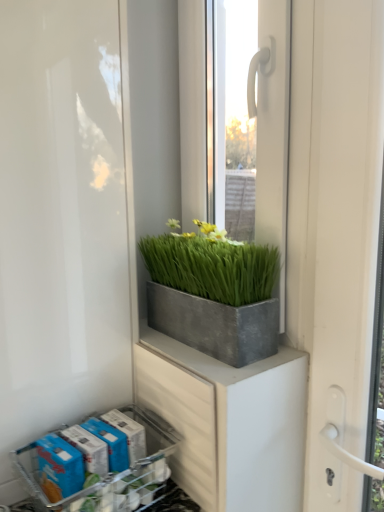
Question: Is metallic gray flower box at lower left positioned before clear glass window at center?

Choices:
 (A) yes
 (B) no

Answer: (A)

Question: Can you confirm if metallic gray flower box at lower left is wider than clear glass window at center?

Choices:
 (A) yes
 (B) no

Answer: (A)

Question: Considering the relative sizes of metallic gray flower box at lower left and clear glass window at center in the image provided, is metallic gray flower box at lower left smaller than clear glass window at center?

Choices:
 (A) no
 (B) yes

Answer: (B)

Question: Considering the relative sizes of metallic gray flower box at lower left and clear glass window at center in the image provided, is metallic gray flower box at lower left shorter than clear glass window at center?

Choices:
 (A) no
 (B) yes

Answer: (B)

Question: Can clear glass window at center be found inside metallic gray flower box at lower left?

Choices:
 (A) no
 (B) yes

Answer: (A)

Question: Is metallic gray flower box at lower left spatially inside white matte screen door at left, or outside of it?

Choices:
 (A) inside
 (B) outside

Answer: (B)

Question: Considering their positions, is metallic gray flower box at lower left located in front of or behind white matte screen door at left?

Choices:
 (A) behind
 (B) front

Answer: (A)

Question: From the image's perspective, is metallic gray flower box at lower left above or below white matte screen door at left?

Choices:
 (A) above
 (B) below

Answer: (B)

Question: From a real-world perspective, relative to white matte screen door at left, is metallic gray flower box at lower left vertically above or below?

Choices:
 (A) above
 (B) below

Answer: (B)

Question: In the image, is clear glass window at center positioned in front of or behind white matte screen door at left?

Choices:
 (A) behind
 (B) front

Answer: (A)

Question: Considering the positions of clear glass window at center and white matte screen door at left in the image, is clear glass window at center wider or thinner than white matte screen door at left?

Choices:
 (A) wide
 (B) thin

Answer: (B)

Question: From the image's perspective, is clear glass window at center above or below white matte screen door at left?

Choices:
 (A) above
 (B) below

Answer: (A)

Question: Does point (279, 225) appear closer or farther from the camera than point (18, 369)?

Choices:
 (A) farther
 (B) closer

Answer: (A)

Question: Considering the positions of white matte screen door at left and metallic gray flower box at lower left in the image, is white matte screen door at left wider or thinner than metallic gray flower box at lower left?

Choices:
 (A) wide
 (B) thin

Answer: (A)

Question: Is white matte screen door at left taller or shorter than metallic gray flower box at lower left?

Choices:
 (A) tall
 (B) short

Answer: (A)